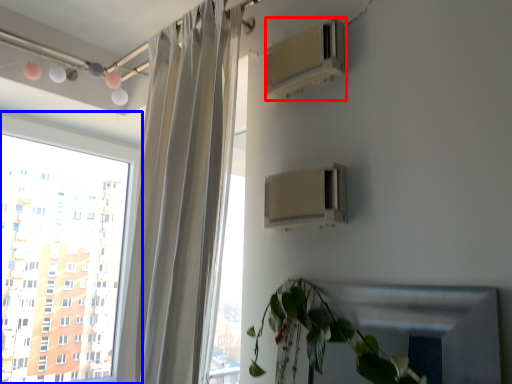
Question: Which point is further to the camera, air conditioning (highlighted by a red box) or window (highlighted by a blue box)?

Choices:
 (A) air conditioning
 (B) window

Answer: (B)